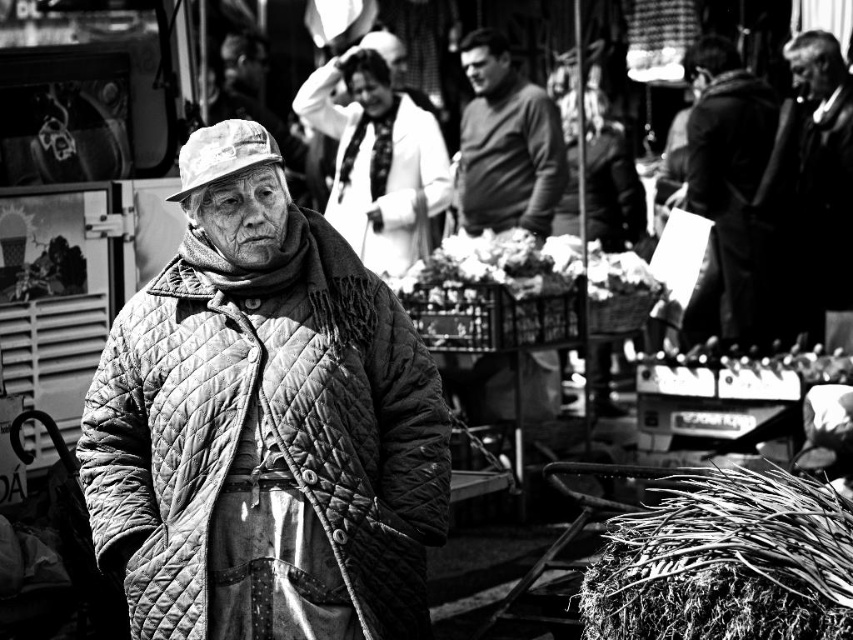
Does smooth black coat at right lie in front of white fabric hat at center?

No.

Is smooth black coat at right taller than white fabric hat at center?

Yes.

Measure the distance between smooth black coat at right and camera.

smooth black coat at right and camera are 120.56 feet apart from each other.

What are the coordinates of `smooth black coat at right` in the screenshot? It's located at (726, 188).

Does quilted fabric coat at left appear on the right side of smooth brown sweater at center?

No, quilted fabric coat at left is not to the right of smooth brown sweater at center.

Can you confirm if quilted fabric coat at left is shorter than smooth brown sweater at center?

Indeed, quilted fabric coat at left has a lesser height compared to smooth brown sweater at center.

The height and width of the screenshot is (640, 853). What do you see at coordinates (264, 422) in the screenshot? I see `quilted fabric coat at left` at bounding box center [264, 422].

At what (x,y) coordinates should I click in order to perform the action: click on quilted fabric coat at left. Please return your answer as a coordinate pair (x, y). This screenshot has width=853, height=640. Looking at the image, I should click on (264, 422).

Is quilted fabric coat at left thinner than coarse straw hay at lower right?

Indeed, quilted fabric coat at left has a lesser width compared to coarse straw hay at lower right.

The width and height of the screenshot is (853, 640). What do you see at coordinates (264, 422) in the screenshot?
I see `quilted fabric coat at left` at bounding box center [264, 422].

Where is `quilted fabric coat at left`? quilted fabric coat at left is located at coordinates (264, 422).